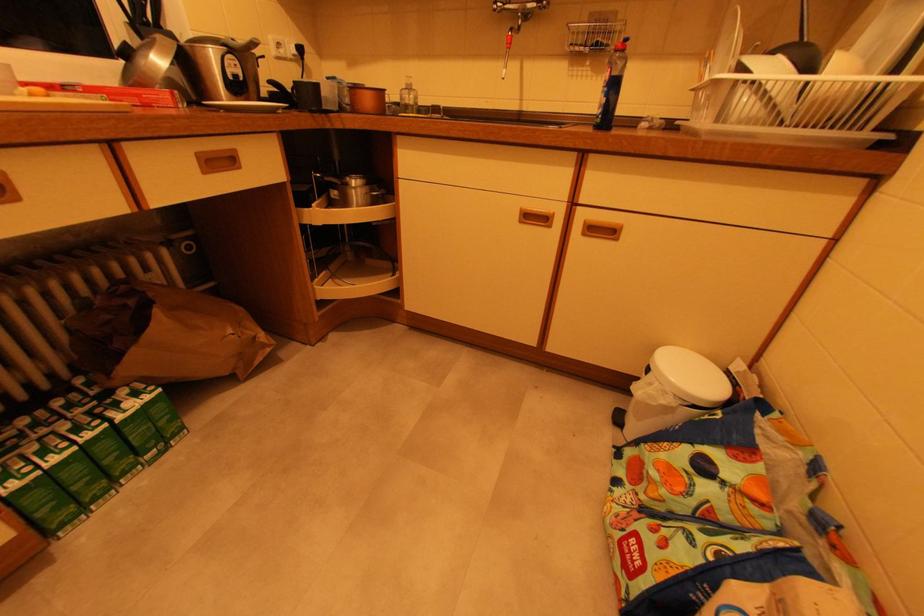
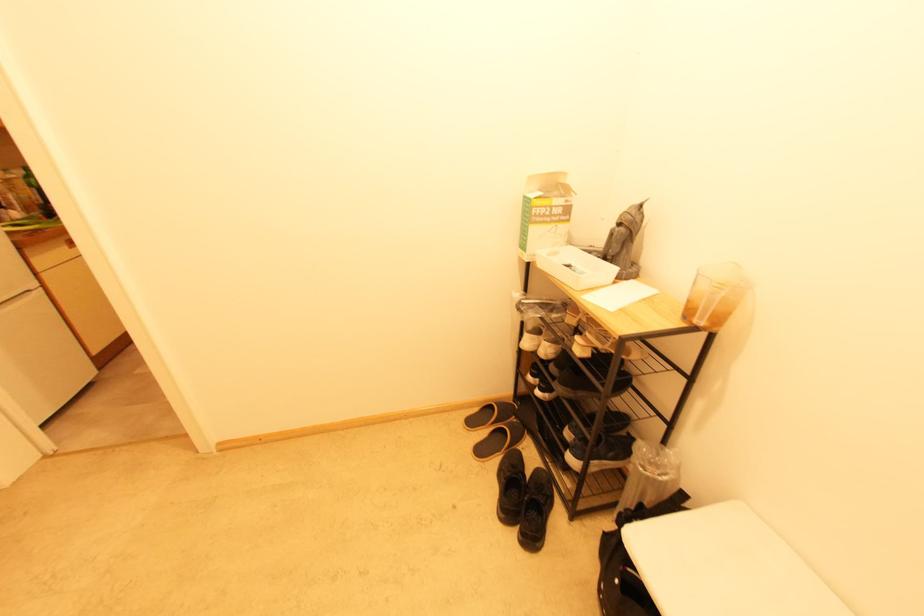
Question: I am providing you with two images of the same scene from different viewpoints. Please identify which objects are invisible in image2.

Choices:
 (A) cardboard mask box
 (B) black shoe
 (C) pot handle
 (D) green sofa sitting surface

Answer: (C)